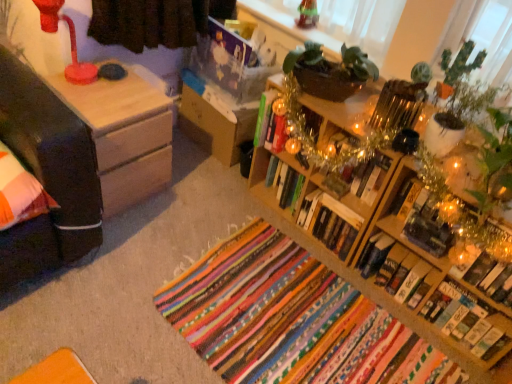
Find the location of a particular element. This screenshot has width=512, height=384. free space underneath multicolored woven rug at center (from a real-world perspective) is located at coordinates pyautogui.click(x=291, y=317).